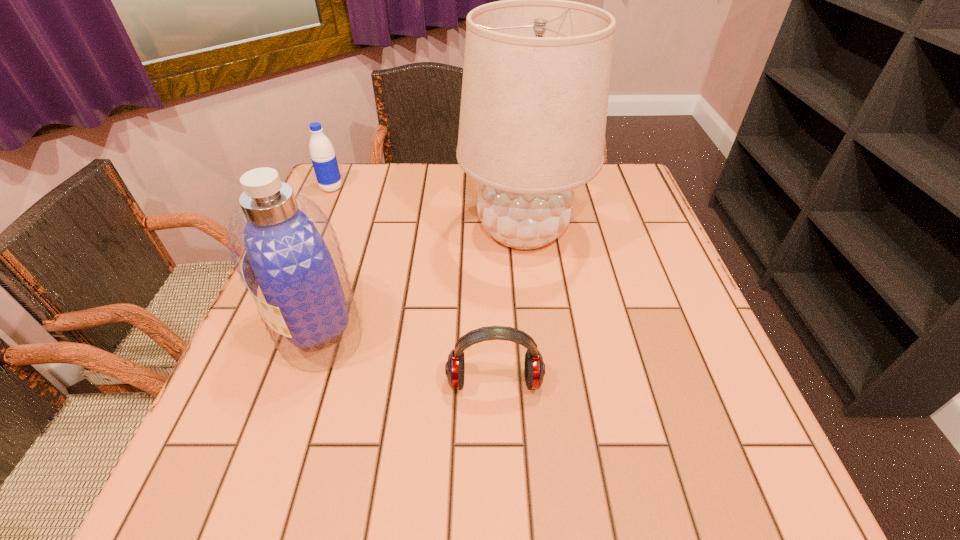
Identify the location of free space at the far right corner of the desktop. (590, 195).

The width and height of the screenshot is (960, 540). Identify the location of vacant space at the near right corner of the desktop. (766, 457).

Image resolution: width=960 pixels, height=540 pixels. What are the coordinates of `vacant point located between the tallest object and the cleansing agent` in the screenshot? It's located at pos(420,280).

Identify the location of vacant area between the cleansing agent and the lampshade. (420, 280).

Image resolution: width=960 pixels, height=540 pixels. I want to click on empty space that is in between the shortest object and the third nearest object, so click(x=509, y=306).

Locate an element on the screen. The image size is (960, 540). free space between the second tallest object and the lampshade is located at coordinates (420, 280).

Where is `unoccupied area between the second tallest object and the shortest object`? Image resolution: width=960 pixels, height=540 pixels. unoccupied area between the second tallest object and the shortest object is located at coordinates (406, 354).

This screenshot has height=540, width=960. I want to click on unoccupied position between the earphone and the second tallest object, so click(406, 354).

At what (x,y) coordinates should I click in order to perform the action: click on vacant space that's between the lampshade and the shortest object. Please return your answer as a coordinate pair (x, y). This screenshot has width=960, height=540. Looking at the image, I should click on (509, 306).

Where is `free space between the lampshade and the earphone`? The image size is (960, 540). free space between the lampshade and the earphone is located at coordinates (509, 306).